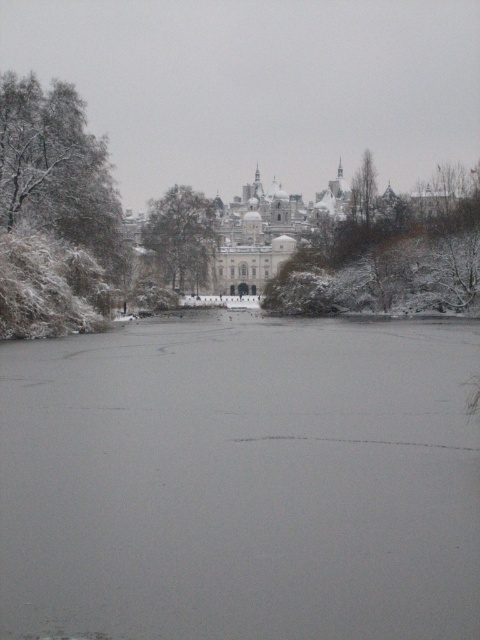
Is white snow-covered tree at left smaller than snow-covered tree at upper center?

Indeed, white snow-covered tree at left has a smaller size compared to snow-covered tree at upper center.

Does white snow-covered tree at left appear on the right side of snow-covered tree at upper center?

No, white snow-covered tree at left is not to the right of snow-covered tree at upper center.

What are the coordinates of `white snow-covered tree at left` in the screenshot? It's located at (54, 212).

Is white snow-covered tree at left further to the viewer compared to snow-covered tree at center?

No, it is not.

Is white snow-covered tree at left taller than snow-covered tree at center?

Yes, white snow-covered tree at left is taller than snow-covered tree at center.

Locate an element on the screen. The width and height of the screenshot is (480, 640). white snow-covered tree at left is located at coordinates [x=54, y=212].

Is snow-covered tree at upper center thinner than snow-covered tree at center?

In fact, snow-covered tree at upper center might be wider than snow-covered tree at center.

Is snow-covered tree at upper center smaller than snow-covered tree at center?

Incorrect, snow-covered tree at upper center is not smaller in size than snow-covered tree at center.

Describe the element at coordinates (387, 260) in the screenshot. I see `snow-covered tree at upper center` at that location.

Where is `snow-covered tree at upper center`? snow-covered tree at upper center is located at coordinates (387, 260).